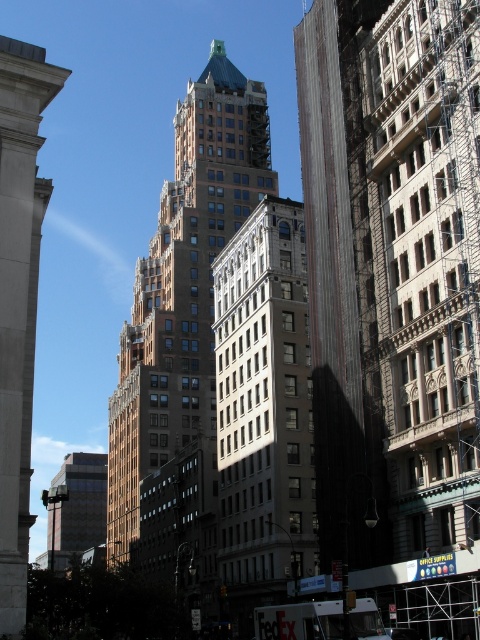
Question: Observing the image, what is the correct spatial positioning of white stone building at center in reference to white stone column at left?

Choices:
 (A) above
 (B) below

Answer: (B)

Question: Can you confirm if brown stone tower at center is positioned to the left of white stone column at left?

Choices:
 (A) no
 (B) yes

Answer: (A)

Question: Which object is farther from the camera taking this photo?

Choices:
 (A) dark brown brick building at center
 (B) glassy reflective building at center
 (C) white stone column at left

Answer: (B)

Question: Which of these objects is positioned farthest from the glassy reflective building at center?

Choices:
 (A) dark brown brick building at center
 (B) white stone column at left
 (C) white stone building at center

Answer: (B)

Question: Which point appears farthest from the camera in this image?

Choices:
 (A) coord(328,99)
 (B) coord(302,451)
 (C) coord(132,442)
 (D) coord(82,506)

Answer: (D)

Question: Can you confirm if brown stone tower at center is thinner than glassy reflective building at center?

Choices:
 (A) no
 (B) yes

Answer: (B)